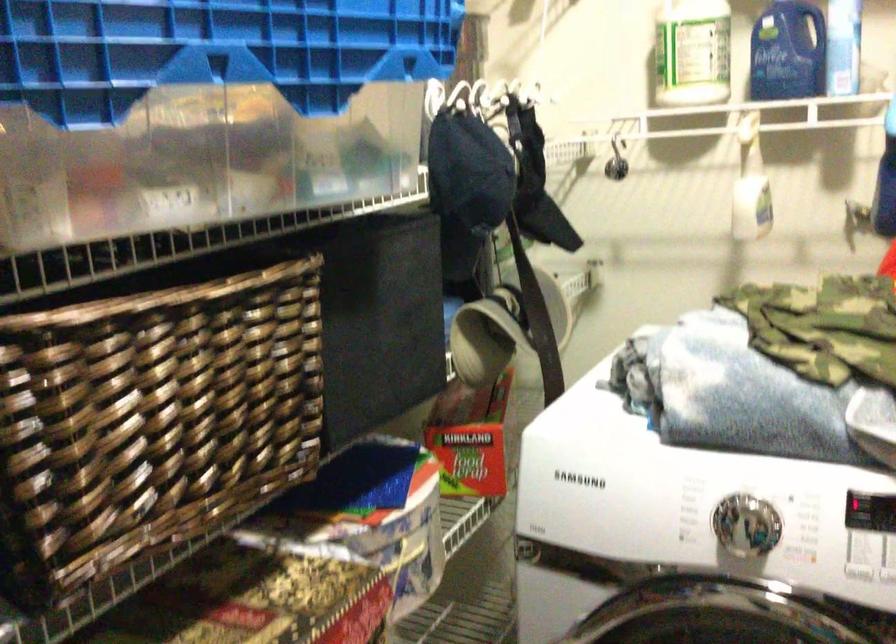
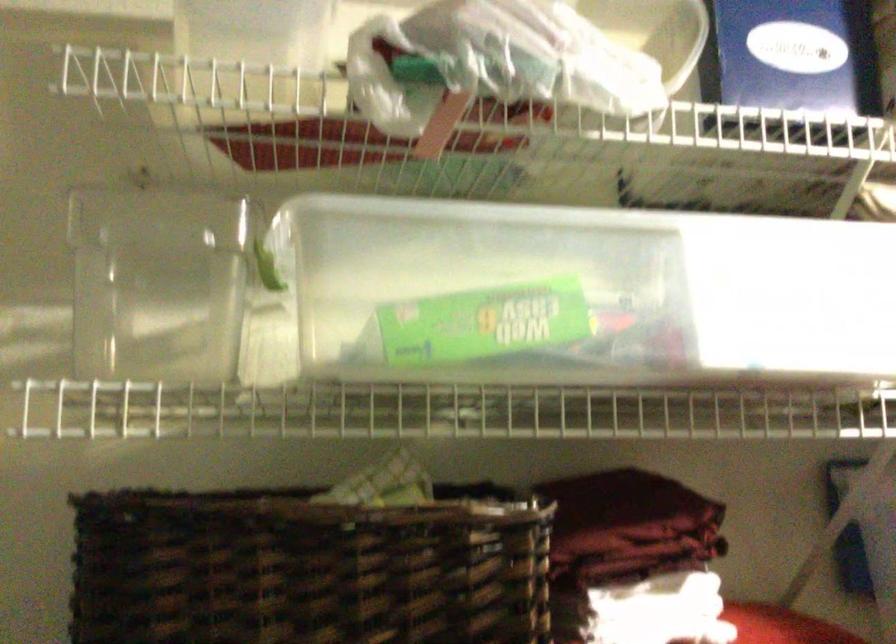
The images are taken continuously from a first-person perspective. In which direction is your viewpoint rotating?

The camera rotated toward left-up.